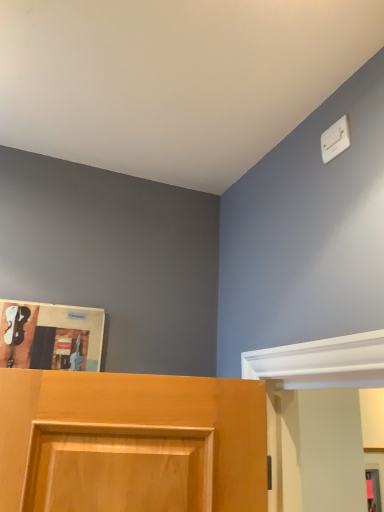
Question: Should I look upward or downward to see white plastic light switch at upper right?

Choices:
 (A) down
 (B) up

Answer: (B)

Question: Can you confirm if white plastic light switch at upper right is taller than matte paper magazine at upper left?

Choices:
 (A) yes
 (B) no

Answer: (B)

Question: Is the position of white plastic light switch at upper right less distant than that of matte paper magazine at upper left?

Choices:
 (A) yes
 (B) no

Answer: (A)

Question: Are white plastic light switch at upper right and matte paper magazine at upper left located far from each other?

Choices:
 (A) yes
 (B) no

Answer: (B)

Question: From a real-world perspective, is white plastic light switch at upper right below matte paper magazine at upper left?

Choices:
 (A) yes
 (B) no

Answer: (B)

Question: From the image's perspective, is white plastic light switch at upper right below matte paper magazine at upper left?

Choices:
 (A) yes
 (B) no

Answer: (B)

Question: Would you say white plastic light switch at upper right contains matte paper magazine at upper left?

Choices:
 (A) yes
 (B) no

Answer: (B)

Question: Does matte paper magazine at upper left appear on the left side of white plastic light switch at upper right?

Choices:
 (A) no
 (B) yes

Answer: (B)

Question: Considering the relative sizes of matte paper magazine at upper left and white plastic light switch at upper right in the image provided, is matte paper magazine at upper left shorter than white plastic light switch at upper right?

Choices:
 (A) yes
 (B) no

Answer: (B)

Question: Is white plastic light switch at upper right completely or partially inside matte paper magazine at upper left?

Choices:
 (A) no
 (B) yes

Answer: (A)

Question: Is matte paper magazine at upper left positioned beyond the bounds of white plastic light switch at upper right?

Choices:
 (A) yes
 (B) no

Answer: (A)

Question: Is the depth of matte paper magazine at upper left greater than that of white plastic light switch at upper right?

Choices:
 (A) yes
 (B) no

Answer: (A)

Question: Does matte paper magazine at upper left have a smaller size compared to white plastic light switch at upper right?

Choices:
 (A) yes
 (B) no

Answer: (B)

Question: In terms of width, does white plastic light switch at upper right look wider or thinner when compared to matte paper magazine at upper left?

Choices:
 (A) wide
 (B) thin

Answer: (B)